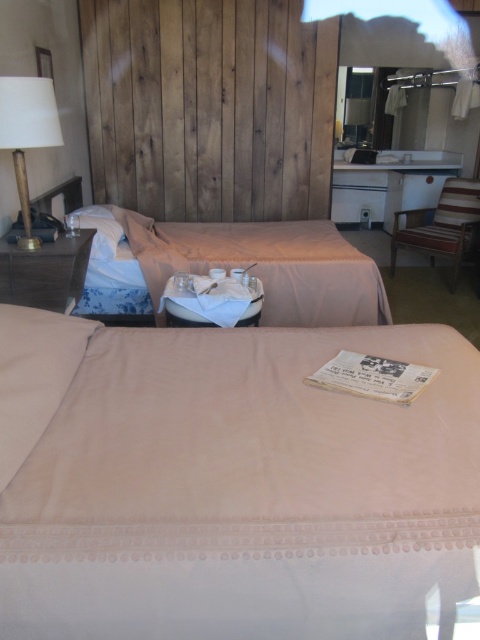
Who is positioned more to the right, beige fabric pillow at lower left or matte gold lamp at upper left?

Positioned to the right is beige fabric pillow at lower left.

Is beige fabric pillow at lower left further to camera compared to matte gold lamp at upper left?

No, it is not.

What do you see at coordinates (34, 376) in the screenshot? I see `beige fabric pillow at lower left` at bounding box center [34, 376].

I want to click on beige fabric pillow at lower left, so click(x=34, y=376).

Can you confirm if pink fabric bed at lower center is positioned above beige fabric bed at center?

Incorrect, pink fabric bed at lower center is not positioned above beige fabric bed at center.

Between pink fabric bed at lower center and beige fabric bed at center, which one has less height?

pink fabric bed at lower center

Identify the location of pink fabric bed at lower center. The width and height of the screenshot is (480, 640). coord(242,490).

Locate an element on the screen. pink fabric bed at lower center is located at coordinates (242, 490).

Does point (201, 268) come closer to viewer compared to point (45, 132)?

No.

Is beige fabric bed at center smaller than matte gold lamp at upper left?

No, beige fabric bed at center is not smaller than matte gold lamp at upper left.

Is point (273, 221) behind point (24, 147)?

That is True.

Where is `beige fabric bed at center`? This screenshot has height=640, width=480. beige fabric bed at center is located at coordinates (256, 266).